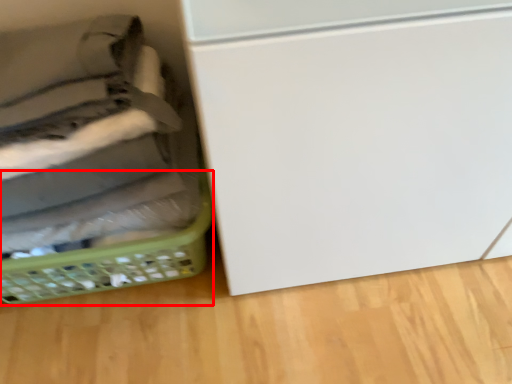
Question: From the image's perspective, where is basket (annotated by the red box) located in relation to basket in the image?

Choices:
 (A) above
 (B) below

Answer: (B)